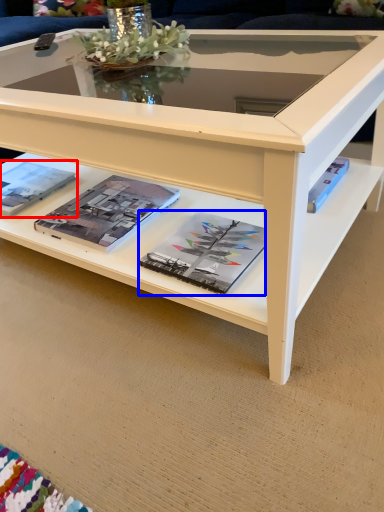
Question: Among these objects, which one is nearest to the camera, magazine (highlighted by a red box) or magazine (highlighted by a blue box)?

Choices:
 (A) magazine
 (B) magazine

Answer: (B)